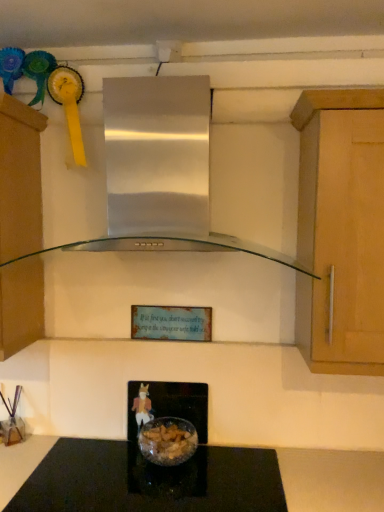
Question: Is stainless steel range hood at center at the right side of matte brown cabinet at left?

Choices:
 (A) yes
 (B) no

Answer: (A)

Question: Is stainless steel range hood at center smaller than matte brown cabinet at left?

Choices:
 (A) no
 (B) yes

Answer: (A)

Question: Is stainless steel range hood at center shorter than matte brown cabinet at left?

Choices:
 (A) yes
 (B) no

Answer: (A)

Question: Is stainless steel range hood at center closer to camera compared to matte brown cabinet at left?

Choices:
 (A) yes
 (B) no

Answer: (A)

Question: Is stainless steel range hood at center oriented towards matte brown cabinet at left?

Choices:
 (A) no
 (B) yes

Answer: (A)

Question: Does stainless steel range hood at center have a greater height compared to matte brown cabinet at left?

Choices:
 (A) no
 (B) yes

Answer: (A)

Question: Is the position of matte brown cabinet at left less distant than that of stainless steel range hood at center?

Choices:
 (A) no
 (B) yes

Answer: (A)

Question: Does matte brown cabinet at left appear on the right side of stainless steel range hood at center?

Choices:
 (A) yes
 (B) no

Answer: (B)

Question: Can you confirm if matte brown cabinet at left is thinner than stainless steel range hood at center?

Choices:
 (A) yes
 (B) no

Answer: (A)

Question: Does matte brown cabinet at left have a greater height compared to stainless steel range hood at center?

Choices:
 (A) yes
 (B) no

Answer: (A)

Question: Is stainless steel range hood at center at the back of matte brown cabinet at left?

Choices:
 (A) yes
 (B) no

Answer: (B)

Question: Does matte brown cabinet at left have a greater width compared to stainless steel range hood at center?

Choices:
 (A) yes
 (B) no

Answer: (B)

Question: Is black glass countertop at center positioned far away from stainless steel range hood at center?

Choices:
 (A) yes
 (B) no

Answer: (B)